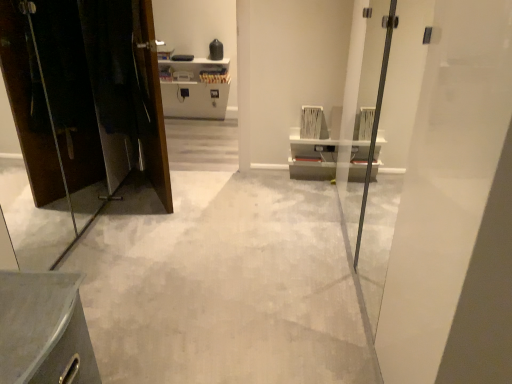
Question: Considering their positions, is gray concrete floor at center located in front of or behind white glossy door at right?

Choices:
 (A) behind
 (B) front

Answer: (A)

Question: Is gray concrete floor at center wider or thinner than white glossy door at right?

Choices:
 (A) wide
 (B) thin

Answer: (A)

Question: Which is farther from the matte black elevator at left?

Choices:
 (A) gray concrete floor at center
 (B) white glossy door at right
 (C) metallic gray cabinet at lower left

Answer: (B)

Question: Estimate the real-world distances between objects in this image. Which object is farther from the white glossy door at right?

Choices:
 (A) gray concrete floor at center
 (B) matte black elevator at left
 (C) metallic gray cabinet at lower left

Answer: (B)